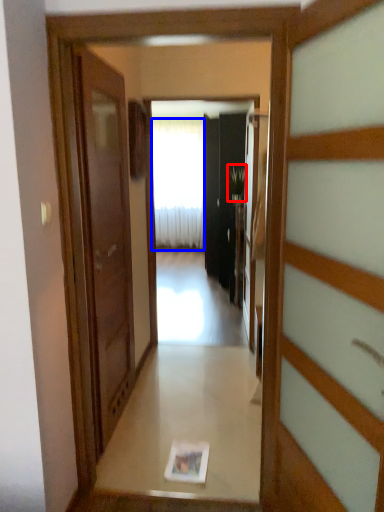
Question: Among these objects, which one is farthest to the camera, plant (highlighted by a red box) or curtain (highlighted by a blue box)?

Choices:
 (A) plant
 (B) curtain

Answer: (B)